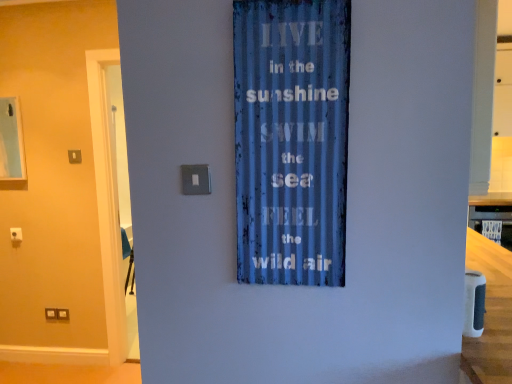
What is the approximate width of satin silver switch at upper center, the first light switch viewed from the back?

satin silver switch at upper center, the first light switch viewed from the back, is 0.87 inches wide.

Locate an element on the screen. Image resolution: width=512 pixels, height=384 pixels. satin silver switch at upper center, the first light switch viewed from the back is located at coordinates (74, 156).

I want to click on blue corrugated metal sign at center, so click(291, 139).

This screenshot has width=512, height=384. Describe the element at coordinates (196, 179) in the screenshot. I see `satin silver switch at center, which is the first light switch from right to left` at that location.

Measure the distance between point (194, 175) and camera.

The distance of point (194, 175) from camera is 3.89 feet.

I want to click on smooth wooden counter top at right, so click(x=490, y=199).

Does blue corrugated metal sign at center touch satin silver switch at upper center, acting as the second light switch starting from the bottom?

blue corrugated metal sign at center and satin silver switch at upper center, acting as the second light switch starting from the bottom, are not in contact.

Between blue corrugated metal sign at center and satin silver switch at upper center, the first light switch viewed from the back, which one has smaller width?

With smaller width is satin silver switch at upper center, the first light switch viewed from the back.

How different are the orientations of blue corrugated metal sign at center and satin silver switch at upper center, which ranks as the 2th light switch in right-to-left order, in degrees?

The angle between the facing direction of blue corrugated metal sign at center and the facing direction of satin silver switch at upper center, which ranks as the 2th light switch in right-to-left order, is 0.547 degrees.

From the image's perspective, is blue corrugated metal sign at center above or below satin silver switch at upper center, the first light switch viewed from the back?

blue corrugated metal sign at center is below satin silver switch at upper center, the first light switch viewed from the back.

Which is further, (193, 178) or (344, 7)?

The point (193, 178) is farther from the camera.

Can you confirm if satin silver switch at center, positioned as the 2th light switch in left-to-right order, is taller than blue corrugated metal sign at center?

No, satin silver switch at center, positioned as the 2th light switch in left-to-right order, is not taller than blue corrugated metal sign at center.

Is satin silver switch at center, placed as the 2th light switch when sorted from top to bottom, surrounding blue corrugated metal sign at center?

Actually, blue corrugated metal sign at center is outside satin silver switch at center, placed as the 2th light switch when sorted from top to bottom.

Which object is closer to the camera taking this photo, satin silver switch at center, which is the 2th light switch in back-to-front order, or blue corrugated metal sign at center?

blue corrugated metal sign at center.

What's the angular difference between smooth wooden counter top at right and satin silver switch at center, the 1th light switch viewed from the front,'s facing directions?

They differ by 0.466 degrees in their facing directions.

Is point (481, 199) positioned after point (187, 190)?

Yes, point (481, 199) is behind point (187, 190).

Are smooth wooden counter top at right and satin silver switch at center, the 1th light switch viewed from the front, far apart?

Indeed, smooth wooden counter top at right is not near satin silver switch at center, the 1th light switch viewed from the front.

Could you tell me if smooth wooden counter top at right is turned towards satin silver switch at center, which is counted as the 1th light switch, starting from the bottom?

No, smooth wooden counter top at right is not facing towards satin silver switch at center, which is counted as the 1th light switch, starting from the bottom.

Considering the positions of point (79, 160) and point (245, 269), is point (79, 160) closer or farther from the camera than point (245, 269)?

Point (79, 160).

In the scene shown: Is satin silver switch at upper center, the first light switch viewed from the back, situated inside blue corrugated metal sign at center or outside?

The correct answer is: outside.

From the picture: From a real-world perspective, which is physically above, satin silver switch at upper center, acting as the first light switch starting from the left, or blue corrugated metal sign at center?

In real-world perspective, blue corrugated metal sign at center is above.

Looking at this image, in the image, is satin silver switch at upper center, marked as the 2th light switch in a front-to-back arrangement, positioned in front of or behind blue corrugated metal sign at center?

Clearly, satin silver switch at upper center, marked as the 2th light switch in a front-to-back arrangement, is behind blue corrugated metal sign at center.

Is satin silver switch at center, which is the 2th light switch in back-to-front order, looking in the opposite direction of smooth wooden counter top at right?

No.

Does satin silver switch at center, positioned as the 2th light switch in left-to-right order, have a lesser height compared to smooth wooden counter top at right?

In fact, satin silver switch at center, positioned as the 2th light switch in left-to-right order, may be taller than smooth wooden counter top at right.

Considering the relative positions of satin silver switch at center, which is the 2th light switch in back-to-front order, and smooth wooden counter top at right in the image provided, is satin silver switch at center, which is the 2th light switch in back-to-front order, to the left of smooth wooden counter top at right from the viewer's perspective?

Indeed, satin silver switch at center, which is the 2th light switch in back-to-front order, is positioned on the left side of smooth wooden counter top at right.

Considering the sizes of objects satin silver switch at center, which is the first light switch from right to left, and smooth wooden counter top at right in the image provided, who is bigger, satin silver switch at center, which is the first light switch from right to left, or smooth wooden counter top at right?

Bigger between the two is smooth wooden counter top at right.

Based on the photo, how many degrees apart are the facing directions of smooth wooden counter top at right and satin silver switch at upper center, marked as the 2th light switch in a front-to-back arrangement?

smooth wooden counter top at right and satin silver switch at upper center, marked as the 2th light switch in a front-to-back arrangement, are facing 0.935 degrees away from each other.

Is smooth wooden counter top at right far from satin silver switch at upper center, marked as the 2th light switch in a front-to-back arrangement?

Yes, smooth wooden counter top at right and satin silver switch at upper center, marked as the 2th light switch in a front-to-back arrangement, are located far from each other.

Is smooth wooden counter top at right aimed at satin silver switch at upper center, marked as the 2th light switch in a front-to-back arrangement?

No, smooth wooden counter top at right is not turned towards satin silver switch at upper center, marked as the 2th light switch in a front-to-back arrangement.

From the image's perspective, which is below, smooth wooden counter top at right or satin silver switch at upper center, marked as the 2th light switch in a front-to-back arrangement?

smooth wooden counter top at right is shown below in the image.

Considering the sizes of objects smooth wooden counter top at right and blue corrugated metal sign at center in the image provided, who is smaller, smooth wooden counter top at right or blue corrugated metal sign at center?

smooth wooden counter top at right.

From a real-world perspective, is smooth wooden counter top at right beneath blue corrugated metal sign at center?

Yes, from a real-world perspective, smooth wooden counter top at right is under blue corrugated metal sign at center.

Is smooth wooden counter top at right far from blue corrugated metal sign at center?

smooth wooden counter top at right is far away from blue corrugated metal sign at center.

Where is `curtain below the satin silver switch at upper center, acting as the first light switch starting from the left (from the image's perspective)`? This screenshot has height=384, width=512. curtain below the satin silver switch at upper center, acting as the first light switch starting from the left (from the image's perspective) is located at coordinates (291, 139).

From the blue corrugated metal sign at center, count the 1st light switch to the left and point to it. Please provide its 2D coordinates.

[(196, 179)]

From the image, which object appears to be nearer to satin silver switch at upper center, the first light switch viewed from the back, satin silver switch at center, placed as the 2th light switch when sorted from top to bottom, or smooth wooden counter top at right?

satin silver switch at center, placed as the 2th light switch when sorted from top to bottom, is positioned closer to the anchor satin silver switch at upper center, the first light switch viewed from the back.

From the image, which object appears to be nearer to satin silver switch at center, which is counted as the 1th light switch, starting from the bottom, blue corrugated metal sign at center or smooth wooden counter top at right?

blue corrugated metal sign at center is closer to satin silver switch at center, which is counted as the 1th light switch, starting from the bottom.

Which object lies further to the anchor point satin silver switch at center, positioned as the 2th light switch in left-to-right order, smooth wooden counter top at right or blue corrugated metal sign at center?

smooth wooden counter top at right.

From the image, which object appears to be nearer to blue corrugated metal sign at center, satin silver switch at upper center, which is the first light switch in top-to-bottom order, or satin silver switch at center, positioned as the 2th light switch in left-to-right order?

The object closer to blue corrugated metal sign at center is satin silver switch at center, positioned as the 2th light switch in left-to-right order.

Based on their spatial positions, is smooth wooden counter top at right or satin silver switch at upper center, marked as the 2th light switch in a front-to-back arrangement, closer to satin silver switch at center, positioned as the 2th light switch in left-to-right order?

Among the two, satin silver switch at upper center, marked as the 2th light switch in a front-to-back arrangement, is located nearer to satin silver switch at center, positioned as the 2th light switch in left-to-right order.

Estimate the real-world distances between objects in this image. Which object is further from blue corrugated metal sign at center, smooth wooden counter top at right or satin silver switch at center, which is the 2th light switch in back-to-front order?

smooth wooden counter top at right is positioned further to the anchor blue corrugated metal sign at center.

Based on their spatial positions, is blue corrugated metal sign at center or satin silver switch at upper center, acting as the first light switch starting from the left, further from satin silver switch at center, placed as the 2th light switch when sorted from top to bottom?

satin silver switch at upper center, acting as the first light switch starting from the left.

Based on their spatial positions, is satin silver switch at upper center, acting as the first light switch starting from the left, or satin silver switch at center, positioned as the 2th light switch in left-to-right order, further from smooth wooden counter top at right?

Among the two, satin silver switch at upper center, acting as the first light switch starting from the left, is located further to smooth wooden counter top at right.

Find the location of a particular element. light switch between blue corrugated metal sign at center and satin silver switch at upper center, marked as the 2th light switch in a front-to-back arrangement, in the front-back direction is located at coordinates (196, 179).

Where is `light switch between satin silver switch at upper center, which ranks as the 2th light switch in right-to-left order, and smooth wooden counter top at right from left to right`? The image size is (512, 384). light switch between satin silver switch at upper center, which ranks as the 2th light switch in right-to-left order, and smooth wooden counter top at right from left to right is located at coordinates (196, 179).

Image resolution: width=512 pixels, height=384 pixels. I want to click on curtain located between satin silver switch at upper center, acting as the second light switch starting from the bottom, and smooth wooden counter top at right in the left-right direction, so click(x=291, y=139).